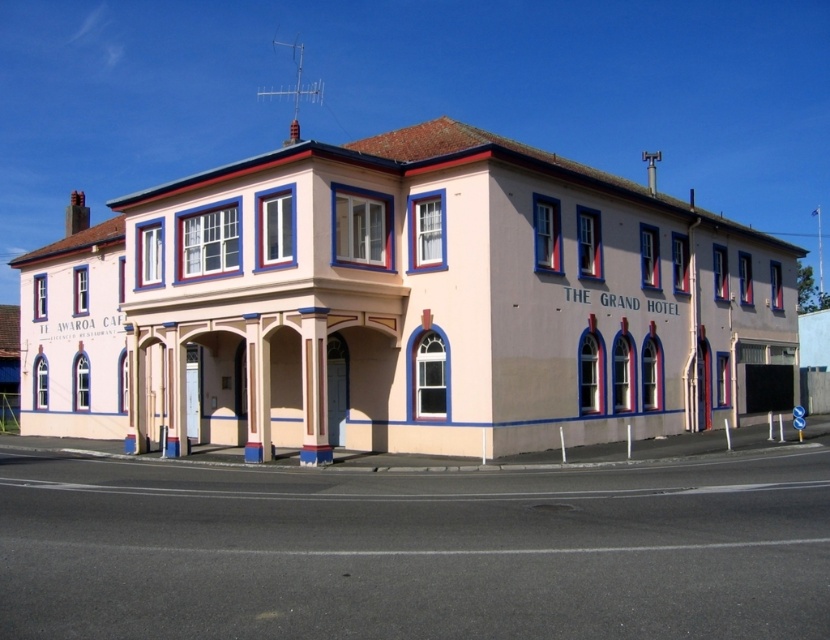
Question: Is blue painted wood trim at upper center to the left of smooth cream-colored column at center from the viewer's perspective?

Choices:
 (A) no
 (B) yes

Answer: (B)

Question: Observing the image, what is the correct spatial positioning of blue painted wood trim at upper center in reference to smooth cream-colored column at center?

Choices:
 (A) right
 (B) left

Answer: (B)

Question: Can you confirm if blue painted wood trim at upper center is wider than smooth cream-colored column at center?

Choices:
 (A) no
 (B) yes

Answer: (B)

Question: Which object is farther from the camera taking this photo?

Choices:
 (A) smooth cream-colored column at center
 (B) blue painted wood trim at upper center

Answer: (B)

Question: Which of the following is the farthest from the observer?

Choices:
 (A) blue painted wood trim at upper center
 (B) smooth cream-colored column at center

Answer: (A)

Question: Among these points, which one is farthest from the camera?

Choices:
 (A) (315, 307)
 (B) (594, 280)

Answer: (B)